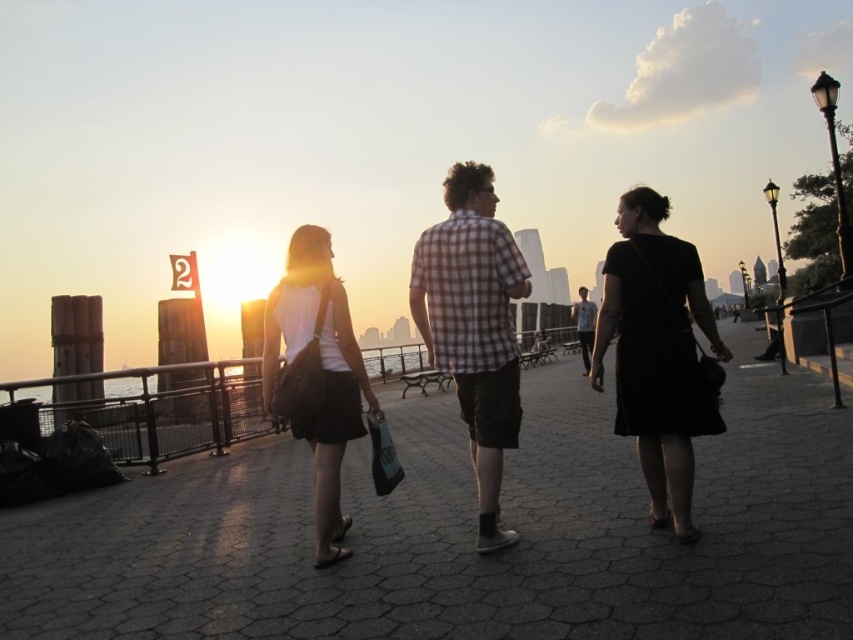
Is checkered fabric shirt at center further to the viewer compared to matte black bag at center?

No, it is in front of matte black bag at center.

Is point (479, 324) positioned in front of point (322, 416)?

No, it is not.

Is point (492, 314) closer to camera compared to point (265, 396)?

Yes, point (492, 314) is in front of point (265, 396).

Where is `checkered fabric shirt at center`? checkered fabric shirt at center is located at coordinates (473, 326).

Can you confirm if black matte dress at center is wider than checkered fabric shirt at center?

No, black matte dress at center is not wider than checkered fabric shirt at center.

Can you confirm if black matte dress at center is thinner than checkered fabric shirt at center?

Indeed, black matte dress at center has a lesser width compared to checkered fabric shirt at center.

Does point (671, 426) lie in front of point (486, 300)?

Yes, point (671, 426) is in front of point (486, 300).

The width and height of the screenshot is (853, 640). Identify the location of black matte dress at center. (657, 353).

Looking at this image, is black matte dress at center to the left of light blue plaid shirt at center from the viewer's perspective?

Correct, you'll find black matte dress at center to the left of light blue plaid shirt at center.

Which of these two, black matte dress at center or light blue plaid shirt at center, stands taller?

light blue plaid shirt at center is taller.

At what (x,y) coordinates should I click in order to perform the action: click on black matte dress at center. Please return your answer as a coordinate pair (x, y). This screenshot has height=640, width=853. Looking at the image, I should click on (657, 353).